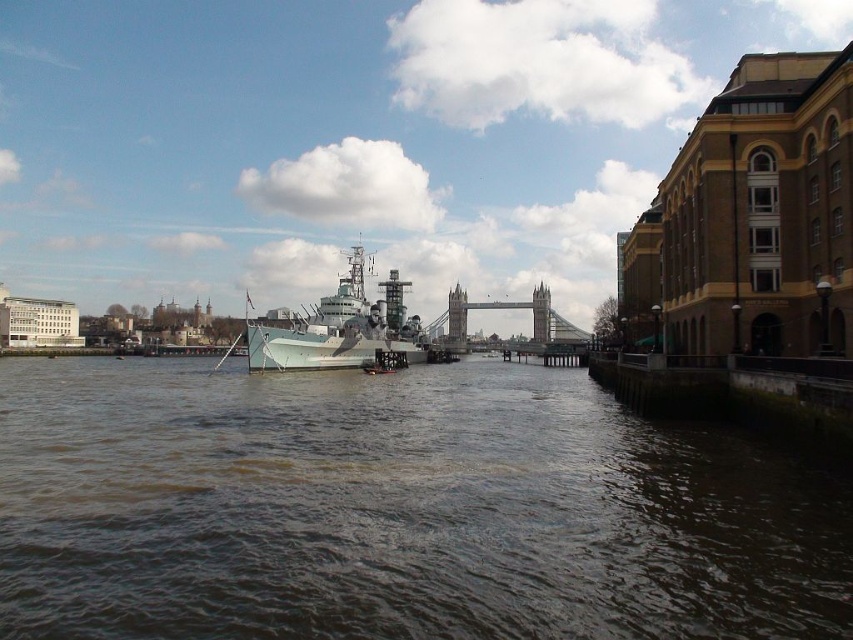
From the picture: Who is shorter, brown murky water at center or stone gray bridge at center?

Standing shorter between the two is brown murky water at center.

Is point (822, 560) positioned after point (463, 320)?

No, it is not.

Identify the location of brown murky water at center. The width and height of the screenshot is (853, 640). (397, 509).

Identify the location of brown murky water at center. (397, 509).

Which is more to the left, brown murky water at center or gray metallic battleship at center?

Positioned to the left is brown murky water at center.

Can you confirm if brown murky water at center is bigger than gray metallic battleship at center?

No.

The width and height of the screenshot is (853, 640). In order to click on brown murky water at center in this screenshot , I will do `click(397, 509)`.

Which is below, gray metallic battleship at center or stone gray bridge at center?

stone gray bridge at center is lower down.

Who is positioned more to the right, gray metallic battleship at center or stone gray bridge at center?

stone gray bridge at center

Between point (300, 324) and point (463, 292), which one is positioned behind?

The point (463, 292) is more distant.

The image size is (853, 640). Find the location of `gray metallic battleship at center`. gray metallic battleship at center is located at coordinates (340, 326).